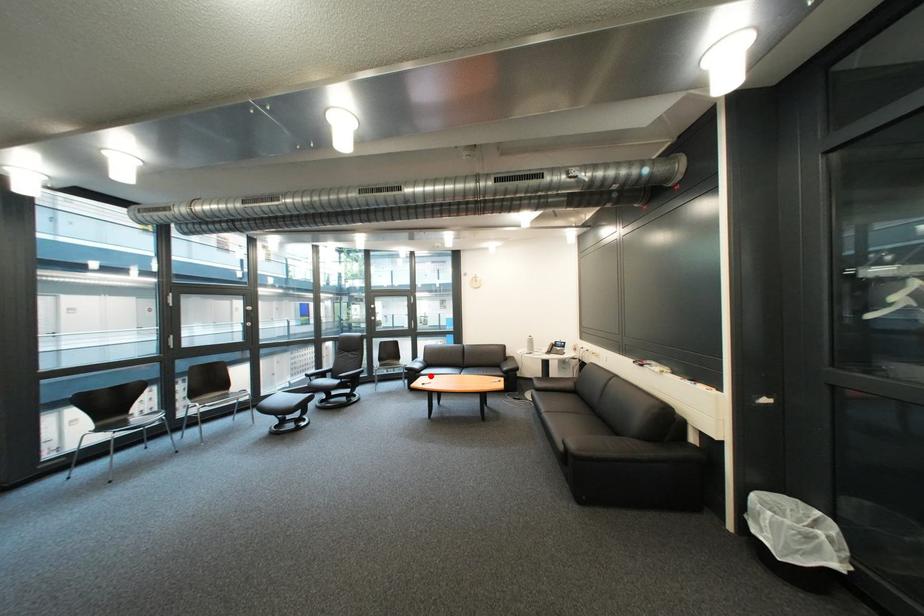
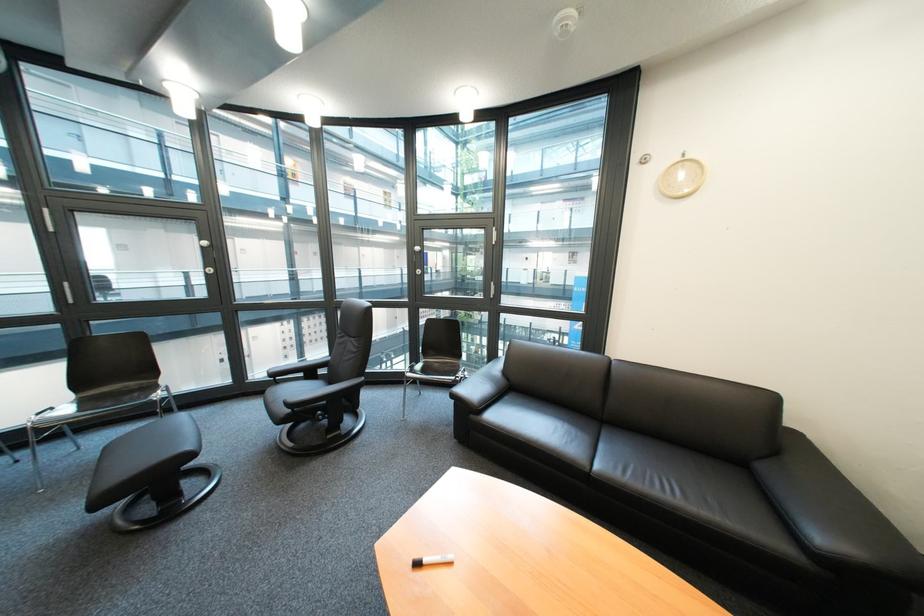
Find the pixel in the second image that matches the highlighted location in the first image.

(485, 418)